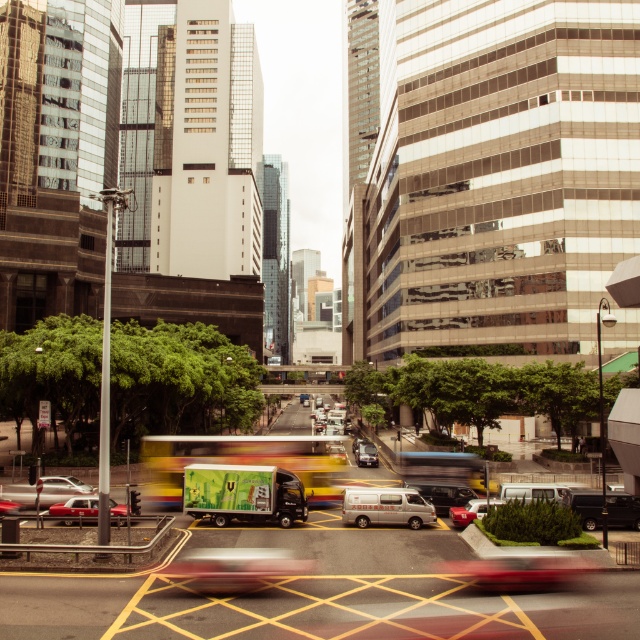
Question: Is green matte truck at center closer to the viewer compared to white matte van at center?

Choices:
 (A) yes
 (B) no

Answer: (A)

Question: Among these points, which one is farthest from the camera?

Choices:
 (A) (84, 512)
 (B) (28, 506)

Answer: (B)

Question: Can you confirm if metallic red taxi at lower left is smaller than shiny red car at center?

Choices:
 (A) no
 (B) yes

Answer: (B)

Question: Considering the real-world distances, which object is farthest from the shiny red car at center?

Choices:
 (A) metallic red taxi at lower left
 (B) white matte van at center
 (C) silver metallic sedan at lower left
 (D) green matte truck at center

Answer: (C)

Question: Which of these objects is positioned farthest from the white matte van at center?

Choices:
 (A) silver metallic sedan at lower left
 (B) shiny red car at center
 (C) green matte truck at center

Answer: (A)

Question: Is white matte van at center above shiny red car at center?

Choices:
 (A) no
 (B) yes

Answer: (B)